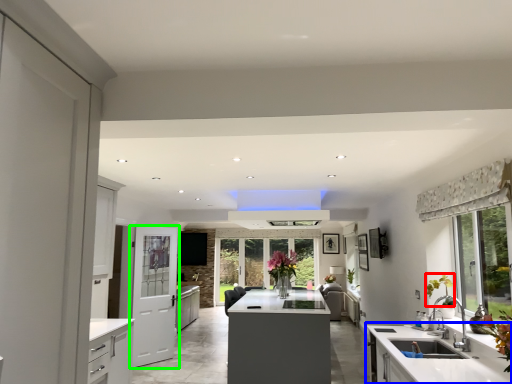
Question: Which is farther away from plant (highlighted by a red box)? countertop (highlighted by a blue box) or door (highlighted by a green box)?

Choices:
 (A) countertop
 (B) door

Answer: (B)